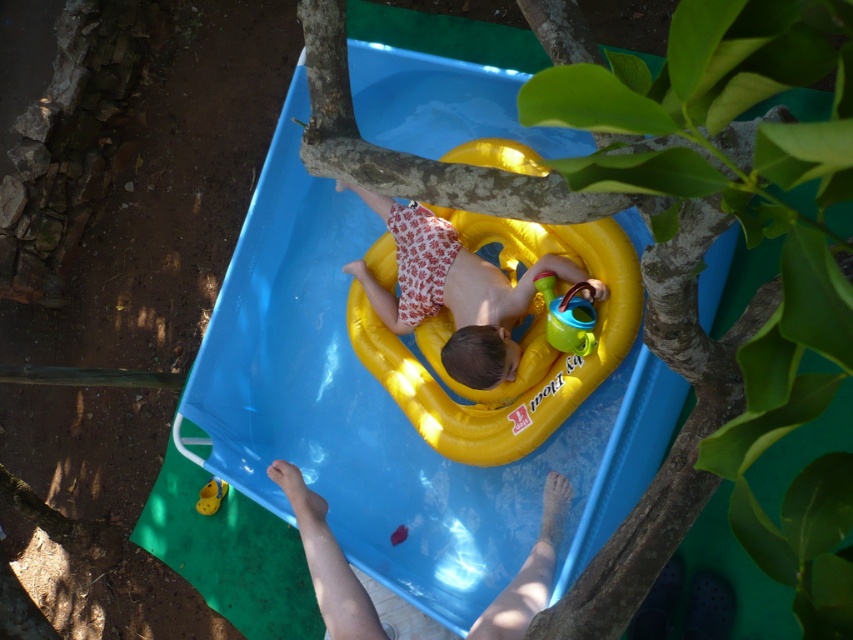
Question: Can you confirm if blue plastic slide at center is bigger than yellow rubber ring at center?

Choices:
 (A) yes
 (B) no

Answer: (A)

Question: Is blue plastic slide at center wider than yellow rubber ring at center?

Choices:
 (A) no
 (B) yes

Answer: (B)

Question: Can you confirm if blue plastic slide at center is thinner than yellow rubber ring at center?

Choices:
 (A) no
 (B) yes

Answer: (A)